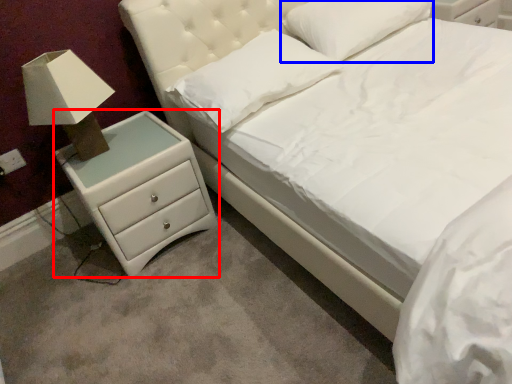
Question: Among these objects, which one is nearest to the camera, chest of drawers (highlighted by a red box) or pillow (highlighted by a blue box)?

Choices:
 (A) chest of drawers
 (B) pillow

Answer: (A)